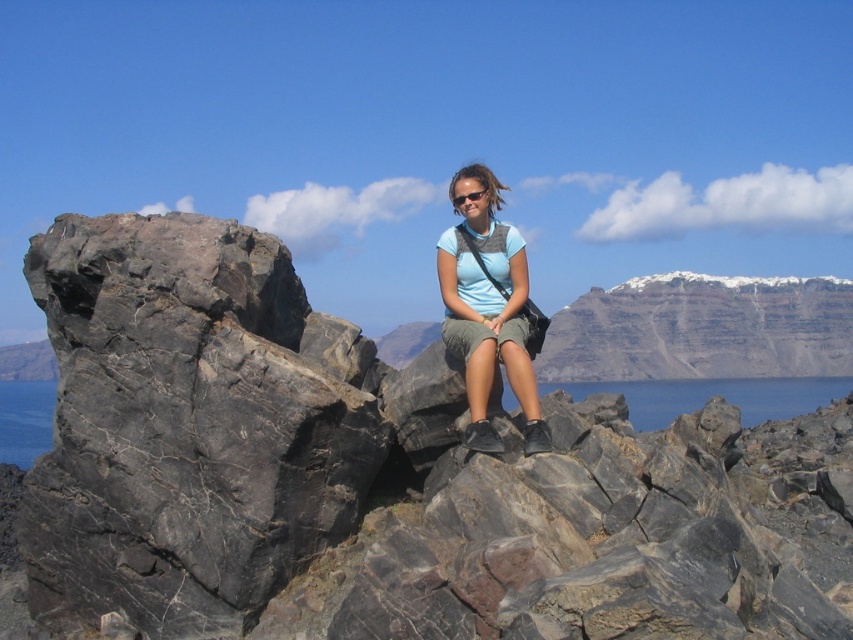
Question: Does blue water at center come behind blue water at lower right?

Choices:
 (A) no
 (B) yes

Answer: (B)

Question: Which of the following is the farthest from the observer?

Choices:
 (A) (459, 196)
 (B) (695, 380)
 (C) (483, 323)
 (D) (718, 381)

Answer: (B)

Question: Is blue water at center wider than blue water at lower right?

Choices:
 (A) no
 (B) yes

Answer: (B)

Question: Does blue water at lower right have a greater width compared to black plastic sunglasses at center?

Choices:
 (A) yes
 (B) no

Answer: (A)

Question: Which of the following is the closest to the observer?

Choices:
 (A) (93, 305)
 (B) (166, 394)
 (C) (805, 349)
 (D) (485, 330)

Answer: (B)

Question: Which point is farther to the camera?

Choices:
 (A) blue water at lower right
 (B) light blue fabric shirt at center
 (C) black rock at left
 (D) black marble rock at center

Answer: (A)